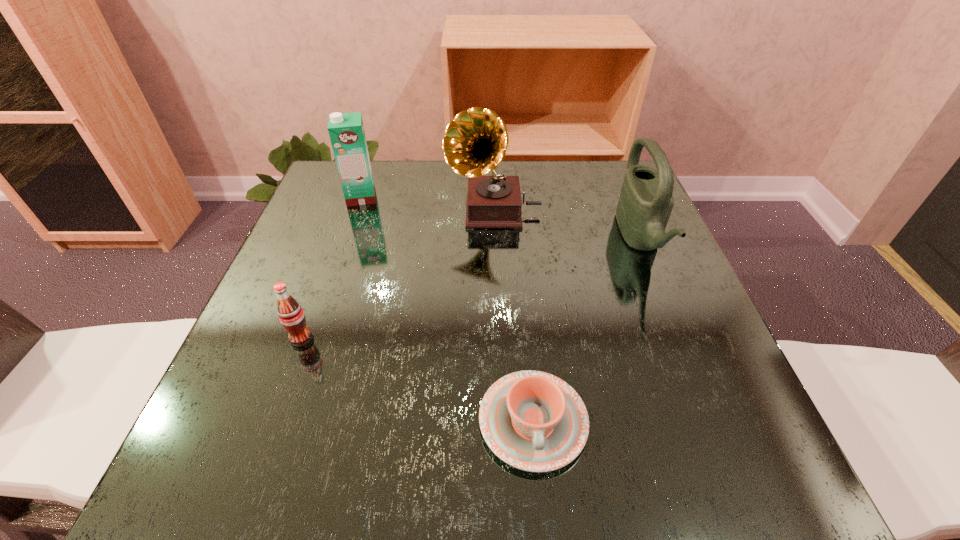
Locate an element on the screen. This screenshot has width=960, height=540. soda that is at the left edge is located at coordinates (291, 315).

You are a GUI agent. You are given a task and a screenshot of the screen. Output one action in this format:
    pyautogui.click(x=<x>, y=<y>)
    Task: Click on the object situated at the right edge
    The image size is (960, 540).
    Given the screenshot: What is the action you would take?
    pyautogui.click(x=646, y=201)

You are a GUI agent. You are given a task and a screenshot of the screen. Output one action in this format:
    pyautogui.click(x=<x>, y=<y>)
    Task: Click on the object positioned at the far left corner
    The width and height of the screenshot is (960, 540).
    Given the screenshot: What is the action you would take?
    pyautogui.click(x=346, y=130)

Where is `object that is at the far right corner`? This screenshot has width=960, height=540. object that is at the far right corner is located at coordinates (646, 201).

This screenshot has height=540, width=960. In the image, there is a desktop. Identify the location of blank space at the far edge. (523, 185).

Find the location of a particular element. vacant space at the left edge of the desktop is located at coordinates point(338,246).

In the image, there is a desktop. Identify the location of vacant space at the right edge. (680, 262).

In the image, there is a desktop. Identify the location of free space at the far left corner. pyautogui.click(x=353, y=208).

Where is `vacant area at the near left corner`? The height and width of the screenshot is (540, 960). vacant area at the near left corner is located at coordinates (214, 454).

The width and height of the screenshot is (960, 540). In order to click on free location at the far right corner of the desktop in this screenshot , I will do `click(584, 197)`.